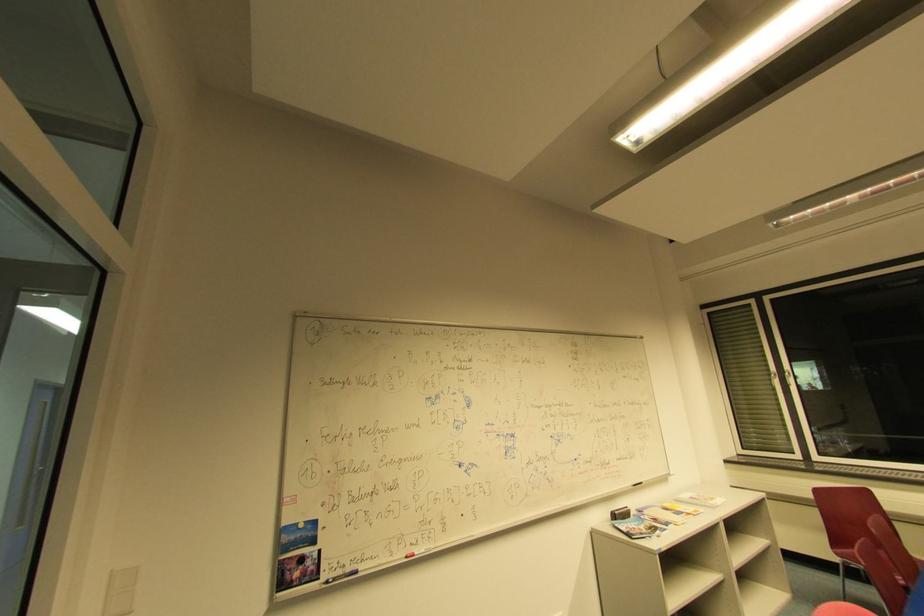
Find where to press the white light switch. Please return your answer as a coordinate pair (x, y).

(120, 591)